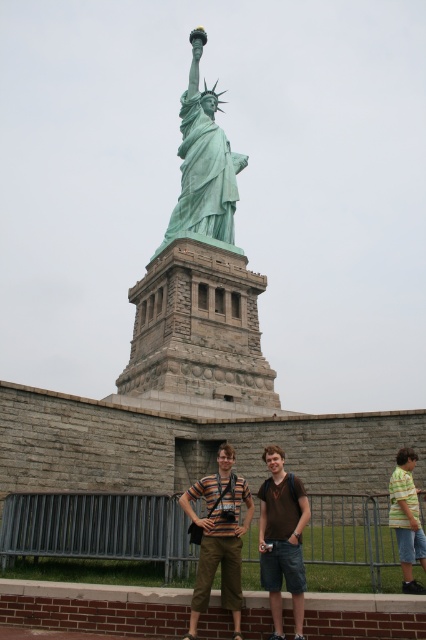
Question: Which point appears closest to the camera in this image?

Choices:
 (A) click(x=396, y=499)
 (B) click(x=282, y=515)
 (C) click(x=207, y=476)
 (D) click(x=218, y=140)

Answer: (B)

Question: Can you confirm if brown cotton t-shirt at center is wider than yellow-green striped shirt at lower right?

Choices:
 (A) no
 (B) yes

Answer: (B)

Question: Is striped cotton shirt at center below brown cotton t-shirt at center?

Choices:
 (A) yes
 (B) no

Answer: (B)

Question: Which object is farther from the camera taking this photo?

Choices:
 (A) yellow-green striped shirt at lower right
 (B) striped cotton shirt at center
 (C) brown cotton t-shirt at center
 (D) green patina statue at center

Answer: (D)

Question: Can you confirm if brown cotton t-shirt at center is wider than yellow-green striped shirt at lower right?

Choices:
 (A) no
 (B) yes

Answer: (B)

Question: Which object is the closest to the brown cotton t-shirt at center?

Choices:
 (A) green patina statue at center
 (B) yellow-green striped shirt at lower right
 (C) striped cotton shirt at center

Answer: (C)